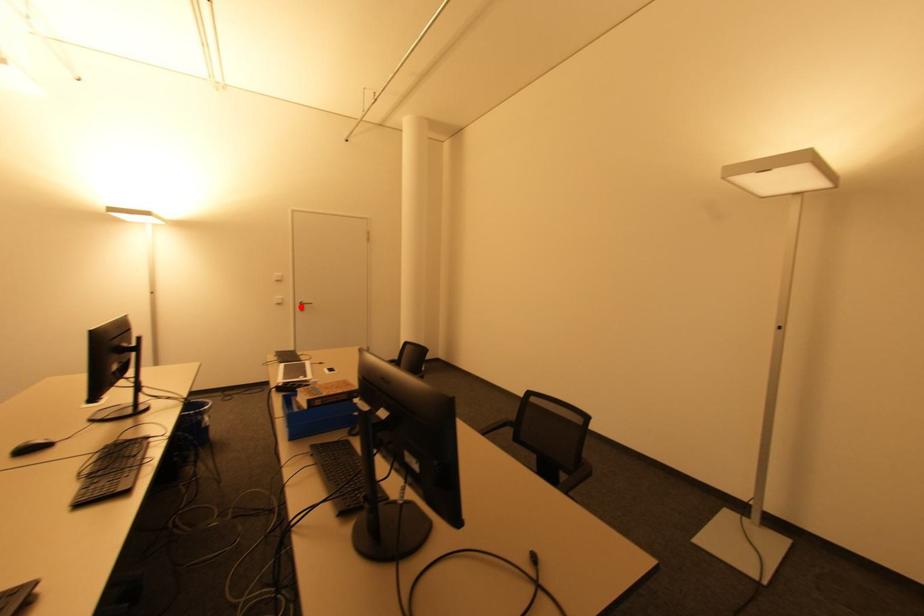
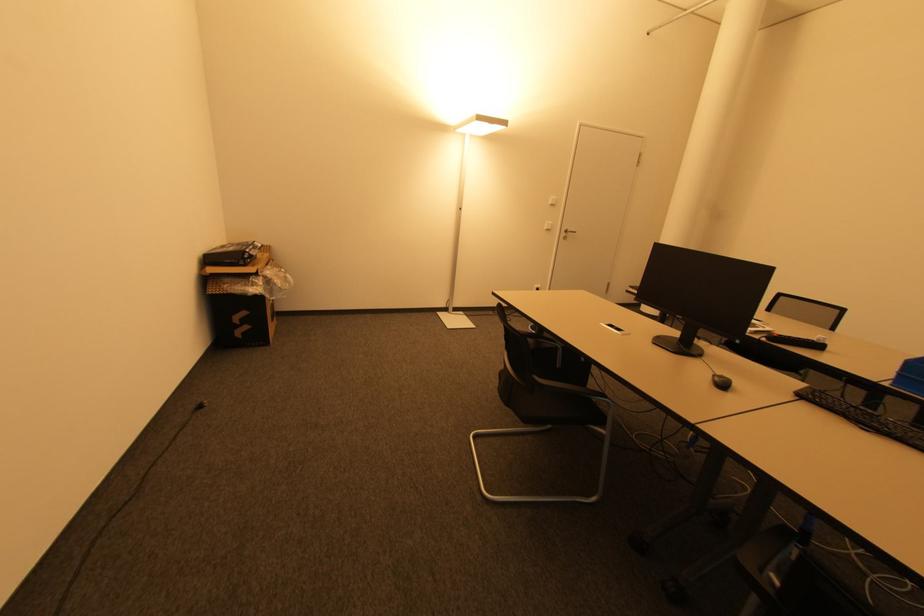
Locate, in the second image, the point that corresponds to the highlighted location in the first image.

(565, 235)